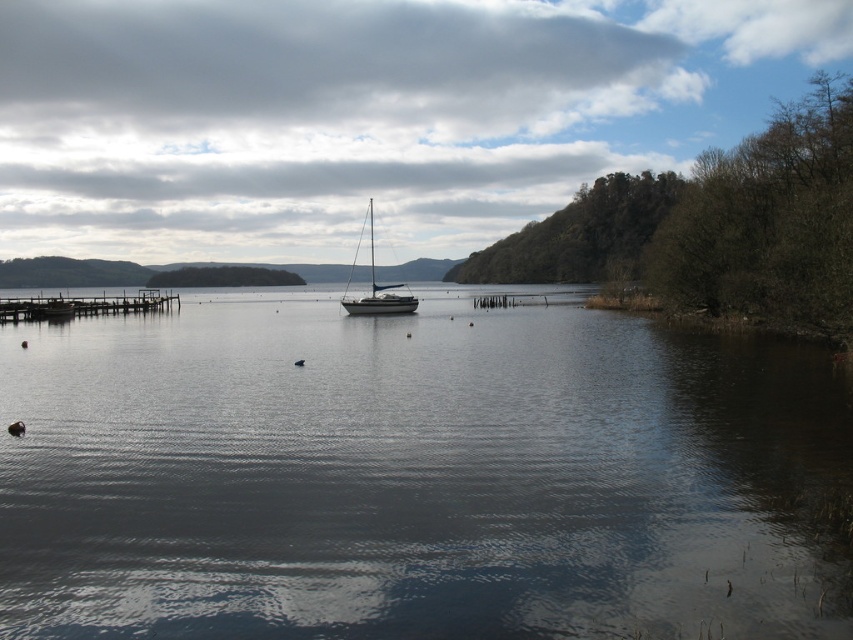
Question: Is wooden pier at left further to the viewer compared to shiny black sailboat at center?

Choices:
 (A) yes
 (B) no

Answer: (A)

Question: Which object is positioned closest to the dark reflective water at center?

Choices:
 (A) shiny black sailboat at center
 (B) wooden pier at left

Answer: (A)

Question: Which object is closer to the camera taking this photo?

Choices:
 (A) dark reflective water at center
 (B) wooden pier at left

Answer: (A)

Question: Does wooden pier at left come in front of shiny black sailboat at center?

Choices:
 (A) no
 (B) yes

Answer: (A)

Question: Does dark reflective water at center have a lesser width compared to shiny black sailboat at center?

Choices:
 (A) no
 (B) yes

Answer: (A)

Question: Which of these objects is positioned farthest from the wooden pier at left?

Choices:
 (A) dark reflective water at center
 (B) shiny black sailboat at center

Answer: (B)